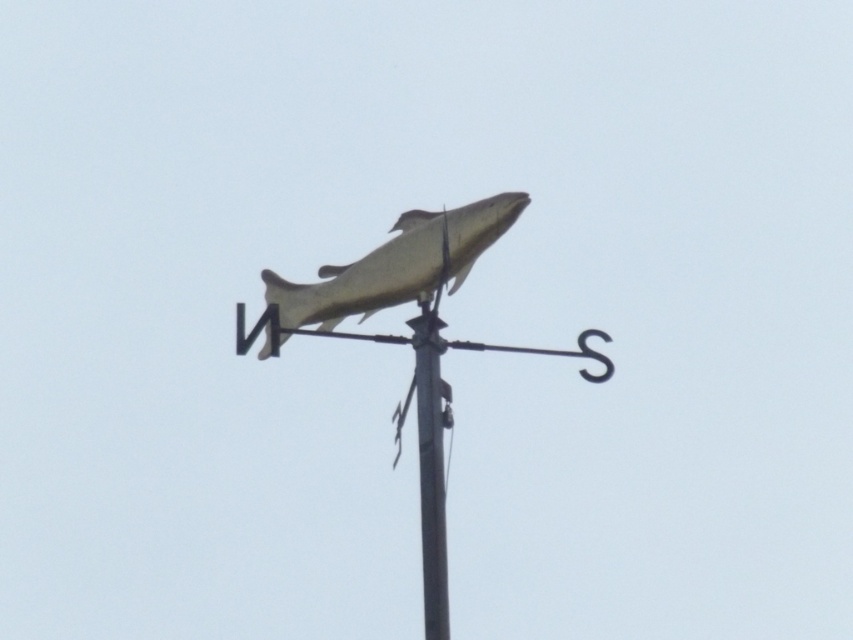
You are standing 359.54 feet away from the metallic gold fish at upper center. If you walk straight towards it, will you eventually see the North and South indicators on the horizontal arm attached to the fish?

Yes, because as you approach the metallic gold fish at upper center from 359.54 feet away, the distance decreases, making the North and South indicators on the horizontal arm more visible as you get closer.

Where is the shiny gold fish at center located in the image?

The shiny gold fish at center is located at point (397, 264).